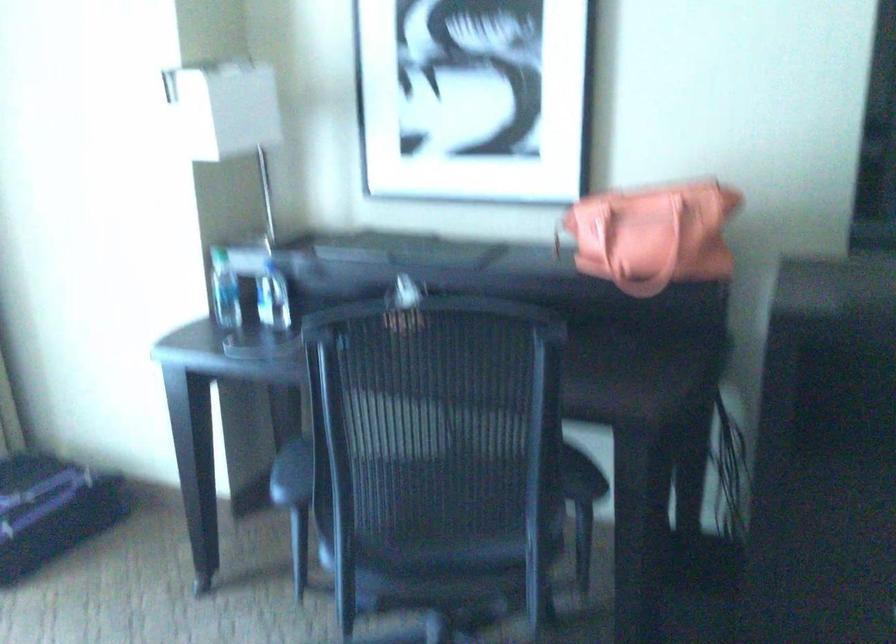
This screenshot has width=896, height=644. Identify the location of orange handbag handle. (633, 238).